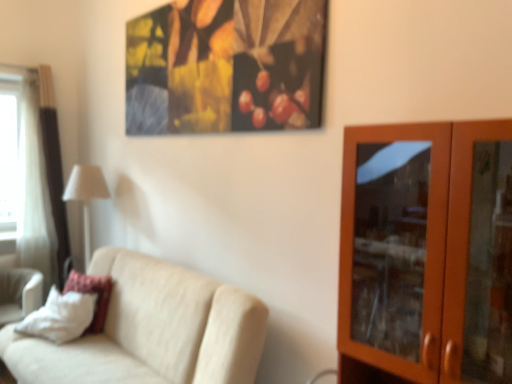
Question: Considering the relative positions of white soft pillow at lower left and brown wooden cabinet at right in the image provided, is white soft pillow at lower left to the left of brown wooden cabinet at right from the viewer's perspective?

Choices:
 (A) yes
 (B) no

Answer: (A)

Question: Is white soft pillow at lower left far away from brown wooden cabinet at right?

Choices:
 (A) no
 (B) yes

Answer: (B)

Question: Is white soft pillow at lower left looking in the opposite direction of brown wooden cabinet at right?

Choices:
 (A) yes
 (B) no

Answer: (B)

Question: Considering the relative sizes of white soft pillow at lower left and brown wooden cabinet at right in the image provided, is white soft pillow at lower left smaller than brown wooden cabinet at right?

Choices:
 (A) no
 (B) yes

Answer: (B)

Question: From the image's perspective, is white soft pillow at lower left above brown wooden cabinet at right?

Choices:
 (A) no
 (B) yes

Answer: (A)

Question: Is white sheer curtain at left inside the boundaries of beige fabric couch at lower left, or outside?

Choices:
 (A) outside
 (B) inside

Answer: (A)

Question: From the image's perspective, is white sheer curtain at left above or below beige fabric couch at lower left?

Choices:
 (A) below
 (B) above

Answer: (B)

Question: Does point (28, 150) appear closer or farther from the camera than point (178, 375)?

Choices:
 (A) farther
 (B) closer

Answer: (A)

Question: In terms of width, does white sheer curtain at left look wider or thinner when compared to beige fabric couch at lower left?

Choices:
 (A) wide
 (B) thin

Answer: (B)

Question: Is point pyautogui.click(x=343, y=223) positioned closer to the camera than point pyautogui.click(x=84, y=215)?

Choices:
 (A) farther
 (B) closer

Answer: (B)

Question: From their relative heights in the image, would you say brown wooden cabinet at right is taller or shorter than white fabric lampshade at left?

Choices:
 (A) short
 (B) tall

Answer: (B)

Question: Based on their positions, is brown wooden cabinet at right located to the left or right of white fabric lampshade at left?

Choices:
 (A) right
 (B) left

Answer: (A)

Question: Is brown wooden cabinet at right in front of or behind white fabric lampshade at left in the image?

Choices:
 (A) front
 (B) behind

Answer: (A)

Question: From a real-world perspective, is white fabric swivel chair at lower left physically located above or below white fabric lampshade at left?

Choices:
 (A) below
 (B) above

Answer: (A)

Question: In terms of height, does white fabric swivel chair at lower left look taller or shorter compared to white fabric lampshade at left?

Choices:
 (A) short
 (B) tall

Answer: (A)